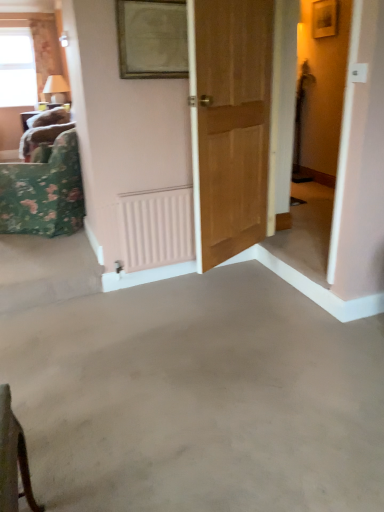
Question: Are floral fabric curtain at upper left and pink matte radiator at center located far from each other?

Choices:
 (A) yes
 (B) no

Answer: (A)

Question: Is floral fabric curtain at upper left to the right of pink matte radiator at center from the viewer's perspective?

Choices:
 (A) no
 (B) yes

Answer: (A)

Question: Does floral fabric curtain at upper left have a greater height compared to pink matte radiator at center?

Choices:
 (A) no
 (B) yes

Answer: (B)

Question: Considering the relative positions of floral fabric curtain at upper left and pink matte radiator at center in the image provided, is floral fabric curtain at upper left in front of pink matte radiator at center?

Choices:
 (A) no
 (B) yes

Answer: (A)

Question: Can you confirm if floral fabric curtain at upper left is shorter than pink matte radiator at center?

Choices:
 (A) no
 (B) yes

Answer: (A)

Question: Can you confirm if floral fabric curtain at upper left is positioned to the left of pink matte radiator at center?

Choices:
 (A) no
 (B) yes

Answer: (B)

Question: Is gold-framed mirror at upper center not within gray concrete floor at center?

Choices:
 (A) no
 (B) yes

Answer: (B)

Question: Is gold-framed mirror at upper center turned away from gray concrete floor at center?

Choices:
 (A) yes
 (B) no

Answer: (B)

Question: Is gold-framed mirror at upper center at the left side of gray concrete floor at center?

Choices:
 (A) yes
 (B) no

Answer: (A)

Question: Is gold-framed mirror at upper center taller than gray concrete floor at center?

Choices:
 (A) yes
 (B) no

Answer: (A)

Question: Could you tell me if gold-framed mirror at upper center is facing gray concrete floor at center?

Choices:
 (A) yes
 (B) no

Answer: (B)

Question: From the image's perspective, is gold-framed mirror at upper center located above gray concrete floor at center?

Choices:
 (A) yes
 (B) no

Answer: (A)

Question: From the image's perspective, is clear glass window at upper left above floral fabric cushion at left?

Choices:
 (A) no
 (B) yes

Answer: (B)